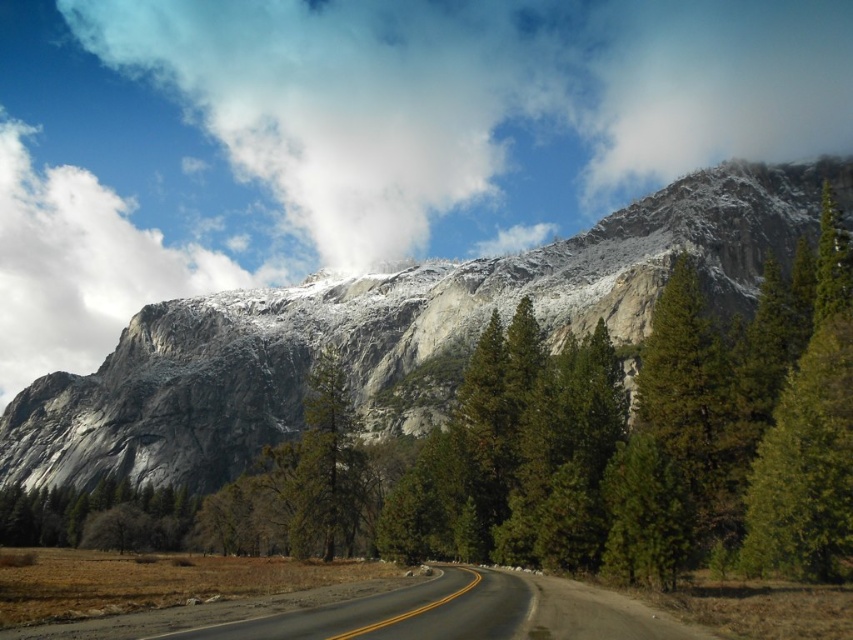
Based on the photo, does gray/rocky mountain at upper center have a larger size compared to green matte tree at center?

Yes.

Identify the location of gray/rocky mountain at upper center. The image size is (853, 640). (389, 332).

The width and height of the screenshot is (853, 640). In order to click on gray/rocky mountain at upper center in this screenshot , I will do click(389, 332).

Measure the distance from white fluffy cloud at upper left to green matte tree at center.

white fluffy cloud at upper left and green matte tree at center are 147.47 meters apart.

Does white fluffy cloud at upper left have a greater height compared to green matte tree at center?

Yes, white fluffy cloud at upper left is taller than green matte tree at center.

Who is more forward, (107, 188) or (320, 454)?

Point (320, 454) is more forward.

This screenshot has height=640, width=853. I want to click on white fluffy cloud at upper left, so click(x=80, y=266).

Does gray/rocky mountain at upper center have a smaller size compared to white fluffy cloud at upper left?

No, gray/rocky mountain at upper center is not smaller than white fluffy cloud at upper left.

Between gray/rocky mountain at upper center and white fluffy cloud at upper left, which one appears on the left side from the viewer's perspective?

From the viewer's perspective, white fluffy cloud at upper left appears more on the left side.

Identify the location of gray/rocky mountain at upper center. The image size is (853, 640). (389, 332).